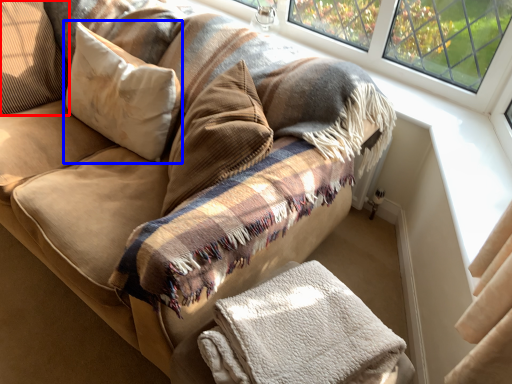
Question: Which of the following is the closest to the observer, pillow (highlighted by a red box) or pillow (highlighted by a blue box)?

Choices:
 (A) pillow
 (B) pillow

Answer: (B)